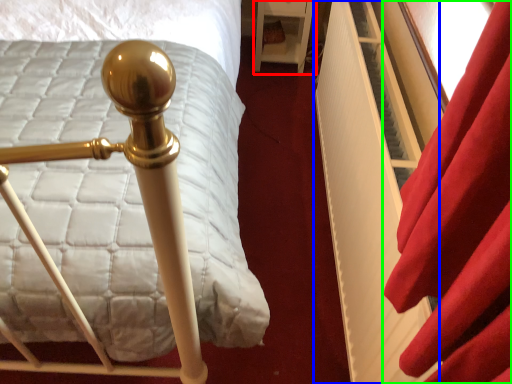
Question: Which object is the closest to the furniture (highlighted by a red box)? Choose among these: bed frame (highlighted by a blue box) or curtain (highlighted by a green box).

Choices:
 (A) bed frame
 (B) curtain

Answer: (A)